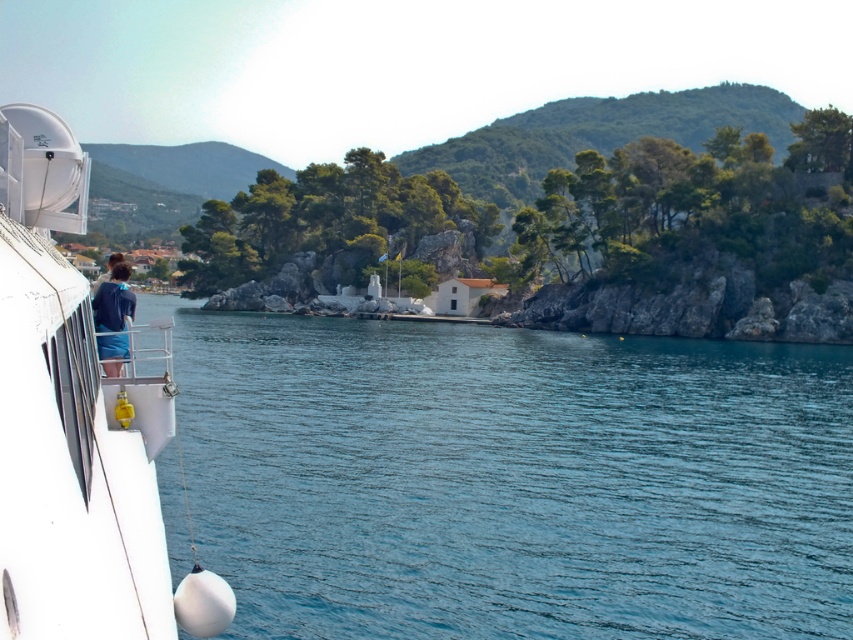
Question: Which point appears closest to the camera in this image?

Choices:
 (A) (78, 227)
 (B) (132, 314)

Answer: (B)

Question: Can you confirm if clear blue water at center is positioned to the left of blue denim shorts at left?

Choices:
 (A) no
 (B) yes

Answer: (A)

Question: Does clear blue water at center come behind blue denim shorts at left?

Choices:
 (A) no
 (B) yes

Answer: (A)

Question: Which point is closer to the camera?

Choices:
 (A) (265, 422)
 (B) (175, 636)
 (C) (105, 321)

Answer: (B)

Question: Can you confirm if white glossy boat at left is positioned above blue denim shorts at left?

Choices:
 (A) no
 (B) yes

Answer: (A)

Question: Among these objects, which one is farthest from the camera?

Choices:
 (A) clear blue water at center
 (B) blue denim shorts at left
 (C) white glossy boat at left

Answer: (B)